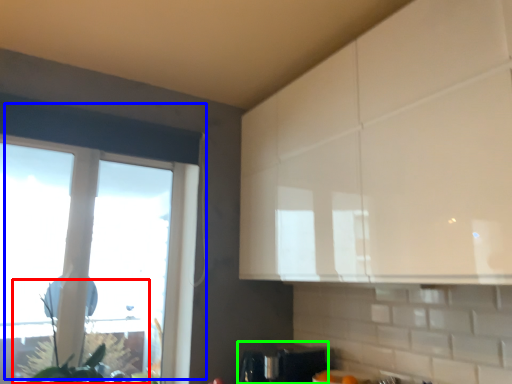
Question: Based on their relative distances, which object is nearer to plant (highlighted by a red box)? Choose from window (highlighted by a blue box) and appliance (highlighted by a green box).

Choices:
 (A) window
 (B) appliance

Answer: (B)